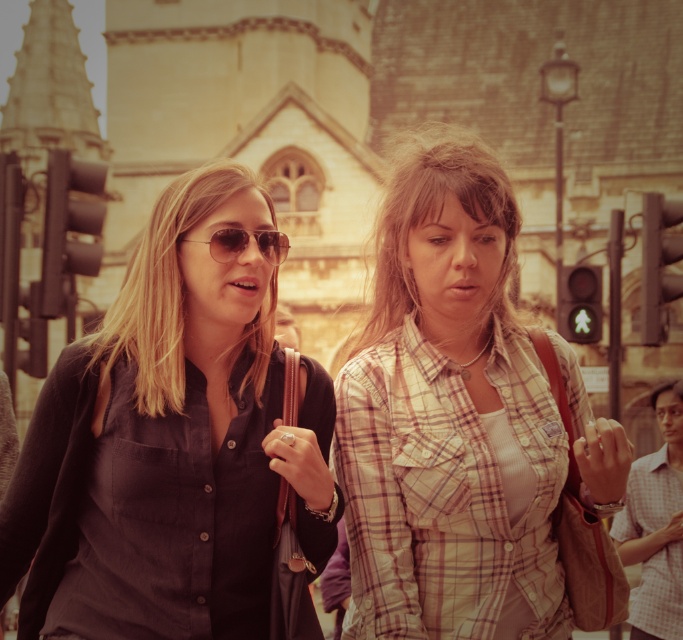
Question: Among these points, which one is nearest to the camera?

Choices:
 (A) (447, 164)
 (B) (273, 234)
 (C) (152, 349)
 (D) (514, 381)

Answer: (C)

Question: Which of the following is the farthest from the observer?

Choices:
 (A) plaid shirt at center
 (B) plaid cotton shirt at center
 (C) matte black shirt at left
 (D) matte aviator sunglasses at center

Answer: (A)

Question: Where is matte black sunglasses at center located in relation to matte aviator sunglasses at center in the image?

Choices:
 (A) right
 (B) left

Answer: (B)

Question: Which of these objects is positioned farthest from the matte black sunglasses at center?

Choices:
 (A) matte black shirt at left
 (B) matte aviator sunglasses at center
 (C) plaid shirt at center
 (D) plaid cotton shirt at center

Answer: (C)

Question: Does plaid cotton shirt at center have a greater width compared to matte black sunglasses at center?

Choices:
 (A) no
 (B) yes

Answer: (A)

Question: Can you confirm if matte black shirt at left is positioned to the right of matte black sunglasses at center?

Choices:
 (A) yes
 (B) no

Answer: (A)